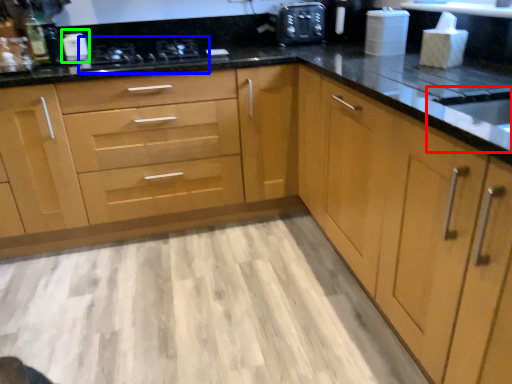
Question: Based on their relative distances, which object is nearer to sink (highlighted by a red box)? Choose from stove (highlighted by a blue box) and appliance (highlighted by a green box).

Choices:
 (A) stove
 (B) appliance

Answer: (A)